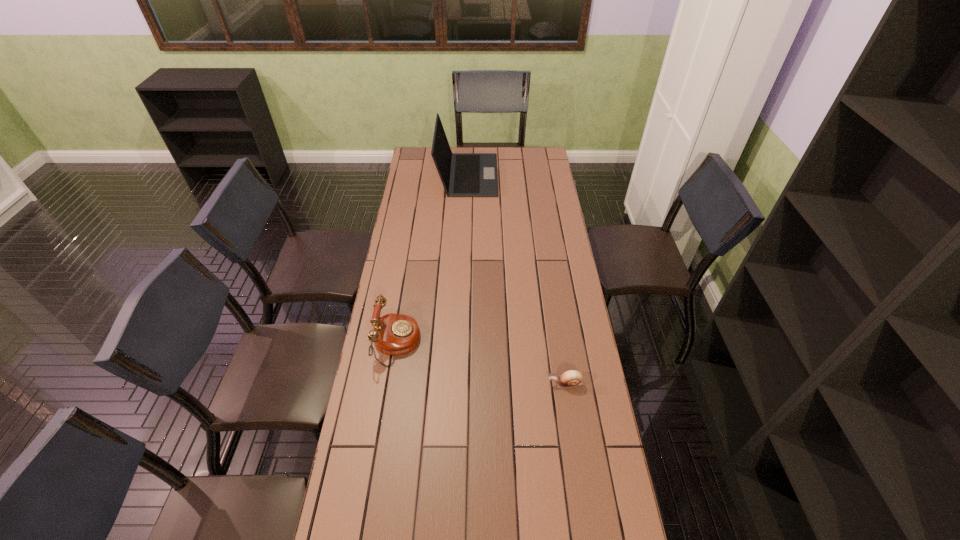
At what (x,y) coordinates should I click in order to perform the action: click on the farthest object. Please return your answer as a coordinate pair (x, y). This screenshot has height=540, width=960. Looking at the image, I should click on (462, 174).

Find the location of a particular element. This screenshot has height=540, width=960. laptop is located at coordinates (462, 174).

Identify the location of telephone. This screenshot has width=960, height=540. (394, 334).

What are the coordinates of `the second shortest object` in the screenshot? It's located at (394, 334).

Where is `the rightmost object`? The image size is (960, 540). the rightmost object is located at coordinates (571, 378).

You are a GUI agent. You are given a task and a screenshot of the screen. Output one action in this format:
    pyautogui.click(x=<x>, y=<y>)
    Task: Click on the escargot
    
    Given the screenshot: What is the action you would take?
    pyautogui.click(x=571, y=378)

Find the location of a particular element. This screenshot has height=540, width=960. vacant space situated on the screen of the tallest object is located at coordinates (518, 174).

What are the coordinates of `blank space located 0.260m on the dial of the telephone` in the screenshot? It's located at (492, 343).

This screenshot has height=540, width=960. What are the coordinates of `vacant space located 0.360m on the front-facing side of the nearest object` in the screenshot? It's located at (440, 384).

Image resolution: width=960 pixels, height=540 pixels. Find the location of `free space located on the front-facing side of the nearest object`. free space located on the front-facing side of the nearest object is located at coordinates (493, 384).